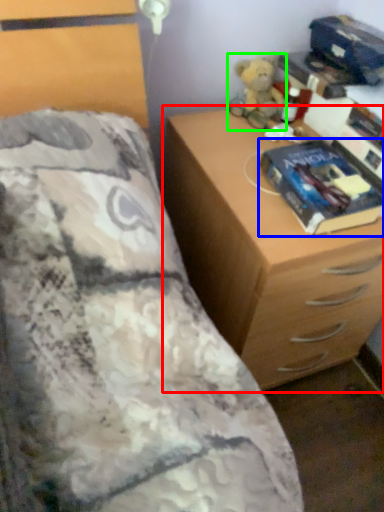
Question: Which object is the closest to the chest of drawers (highlighted by a red box)? Choose among these: paperback book (highlighted by a blue box) or toy (highlighted by a green box).

Choices:
 (A) paperback book
 (B) toy

Answer: (A)